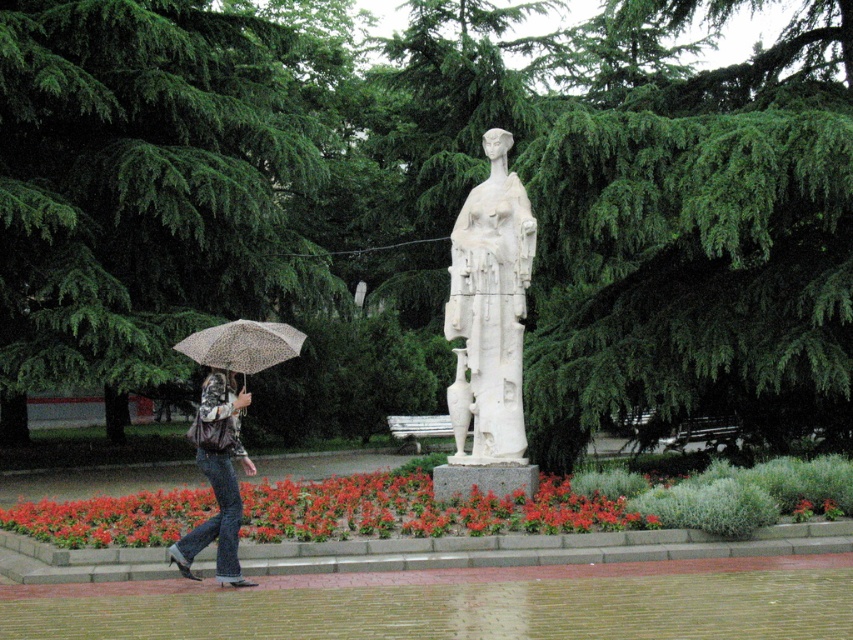
Can you confirm if green leafy tree at upper left is positioned to the right of white marble statue at center?

In fact, green leafy tree at upper left is to the left of white marble statue at center.

Does green leafy tree at upper left appear on the left side of white marble statue at center?

Yes, green leafy tree at upper left is to the left of white marble statue at center.

Is point (9, 106) farther from camera compared to point (494, 371)?

Yes, it is.

Find the location of `green leafy tree at upper left`. green leafy tree at upper left is located at coordinates [146, 186].

Does green leafy tree at center have a larger size compared to green leafy tree at upper left?

Yes.

Does green leafy tree at center appear on the left side of green leafy tree at upper left?

Incorrect, green leafy tree at center is not on the left side of green leafy tree at upper left.

Identify the location of green leafy tree at center. (424, 209).

Where is `green leafy tree at center`? green leafy tree at center is located at coordinates (424, 209).

I want to click on green leafy tree at center, so click(x=424, y=209).

Does green leafy tree at center have a smaller size compared to denim jeans at left?

No.

What do you see at coordinates (424, 209) in the screenshot? This screenshot has height=640, width=853. I see `green leafy tree at center` at bounding box center [424, 209].

This screenshot has width=853, height=640. What are the coordinates of `green leafy tree at center` in the screenshot? It's located at (424, 209).